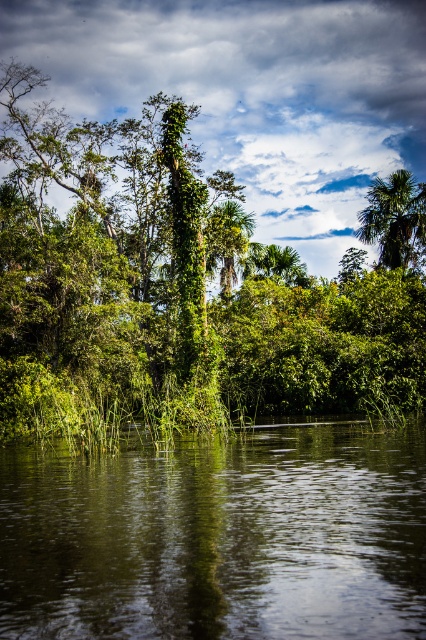
What do you see at coordinates (396, 220) in the screenshot? The height and width of the screenshot is (640, 426). I see `green leafy palm tree at upper right` at bounding box center [396, 220].

How far apart are green leafy palm tree at upper right and green leafy palm tree at center?

green leafy palm tree at upper right is 39.73 feet away from green leafy palm tree at center.

The image size is (426, 640). In order to click on green leafy palm tree at upper right in this screenshot , I will do `click(396, 220)`.

Does green reflective water at center have a lesser height compared to green leafy palm tree at upper right?

Indeed, green reflective water at center has a lesser height compared to green leafy palm tree at upper right.

Does green reflective water at center have a greater height compared to green leafy palm tree at upper right?

No, green reflective water at center is not taller than green leafy palm tree at upper right.

Find the location of `green reflective water at center`. green reflective water at center is located at coordinates (219, 538).

Is green leafy tree at center smaller than green leafy palm tree at upper right?

Actually, green leafy tree at center might be larger than green leafy palm tree at upper right.

In the scene shown: Does green leafy tree at center appear on the left side of green leafy palm tree at upper right?

Yes, green leafy tree at center is to the left of green leafy palm tree at upper right.

Where is `green leafy tree at center`? Image resolution: width=426 pixels, height=640 pixels. green leafy tree at center is located at coordinates (172, 291).